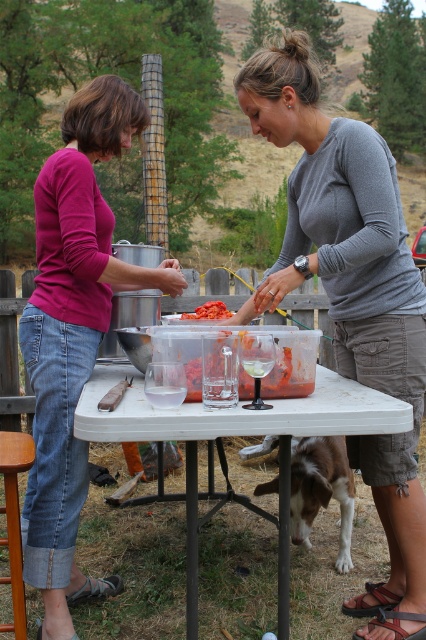
You are setting up a picnic and need to place the bright red diced tomatoes at center on the wooden stool at lower left. Given the sizes, will the tomatoes fit on the stool without spilling over?

The wooden stool at lower left is wider than the bright red diced tomatoes at center, so the tomatoes should fit without spilling over.

You are a photographer setting up a shoot in the backyard. You notice the gray cotton shirt at center and the white plastic table at center. Based on their heights, which object would you need to adjust the camera angle to capture fully in a single shot?

The gray cotton shirt at center is taller than the white plastic table at center, so you would need to adjust the camera angle to capture the gray cotton shirt at center fully in the shot.

You are organizing a picnic and need to decide whether to bring a blanket. The gray cotton shirt at center and the white plastic table at center are both present in the scene. Which object is narrower, and therefore might indicate the space available for a blanket?

The gray cotton shirt at center is narrower than the white plastic table at center, so it might indicate that there is enough space for a blanket.